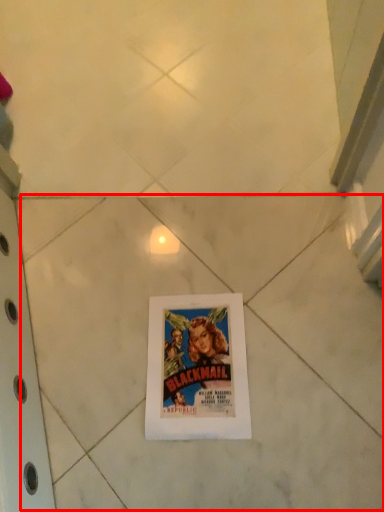
Question: Where is tile (annotated by the red box) located in relation to picture frame in the image?

Choices:
 (A) right
 (B) left

Answer: (B)